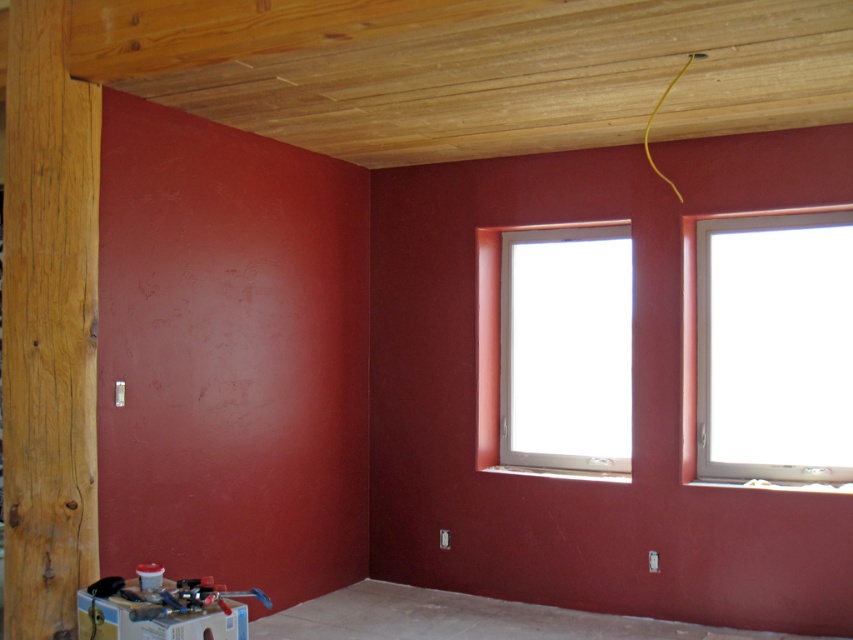
Question: Estimate the real-world distances between objects in this image. Which object is closer to the white plastic window at upper right?

Choices:
 (A) natural wood pillar at left
 (B) white plastic window at center

Answer: (B)

Question: Which of these objects is positioned farthest from the white plastic window at center?

Choices:
 (A) natural wood pillar at left
 (B) white plastic window at upper right

Answer: (A)

Question: Considering the relative positions of natural wood pillar at left and white plastic window at upper right in the image provided, where is natural wood pillar at left located with respect to white plastic window at upper right?

Choices:
 (A) above
 (B) below

Answer: (A)

Question: Estimate the real-world distances between objects in this image. Which object is farther from the natural wood pillar at left?

Choices:
 (A) white plastic window at upper right
 (B) white plastic window at center

Answer: (A)

Question: Observing the image, what is the correct spatial positioning of natural wood pillar at left in reference to white plastic window at center?

Choices:
 (A) left
 (B) right

Answer: (A)

Question: Is natural wood pillar at left smaller than white plastic window at upper right?

Choices:
 (A) yes
 (B) no

Answer: (A)